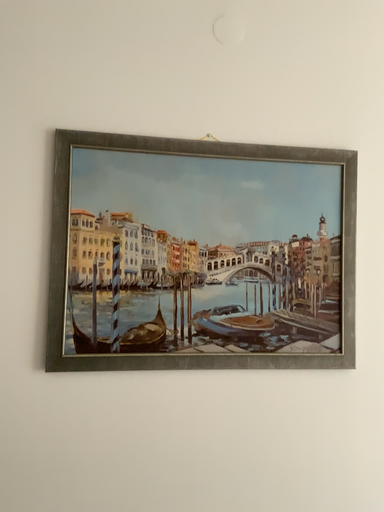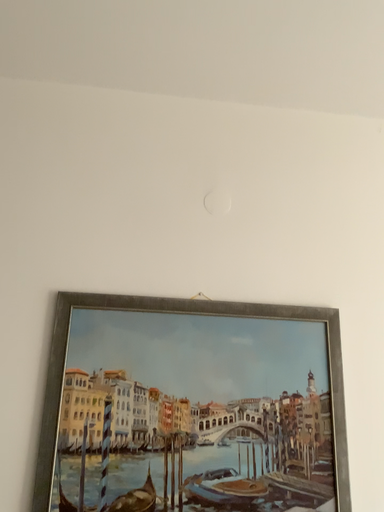
Question: Which way did the camera rotate in the video?

Choices:
 (A) rotated downward
 (B) rotated upward

Answer: (B)